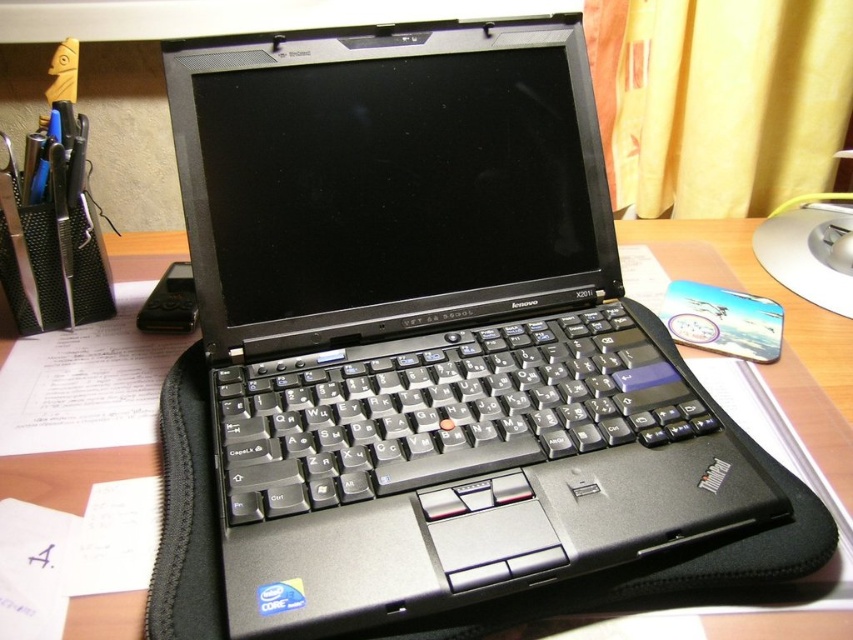
You are organizing items on a desk and need to place a new mouse. The mouse is 10 cm wide. There is a space between the black matte laptop at center and the black plastic keyboard at center. Can the mouse fit in that space?

The black matte laptop at center is to the left of the black plastic keyboard at center. Since the mouse is 10 cm wide and the space between them is at least 10 cm, the mouse can fit in the space between the black matte laptop at center and the black plastic keyboard at center.

You are taking a photo of the laptop and the pen holder. The camera is positioned so that you can see both objects clearly. Which of the two points, point (584, 294) or point (614, 339), is closer to the camera?

Point (584, 294) is closer to the camera than point (614, 339) because it is further to the camera than the other point.

You are setting up a workspace and have both the black matte laptop at center and the black plastic keyboard at center. Since you want to save space, which object should you place closer to the edge of the desk to prevent it from falling off?

The black plastic keyboard at center should be placed closer to the edge because it is smaller and less likely to fall off compared to the larger black matte laptop at center.